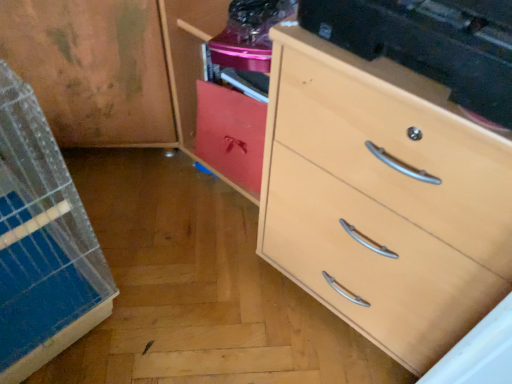
I want to click on vacant space situated above matte red cabinet at center (from a real-world perspective), so click(x=234, y=91).